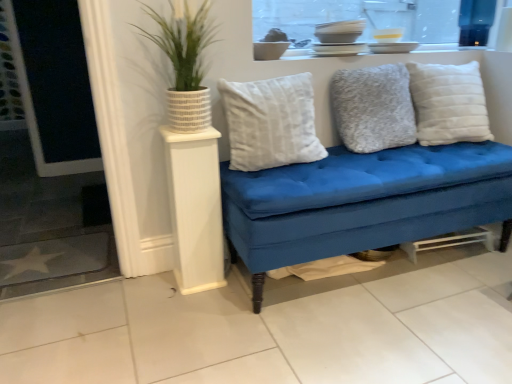
Locate an element on the screen. free space on the front side of white wood side table at left is located at coordinates (193, 301).